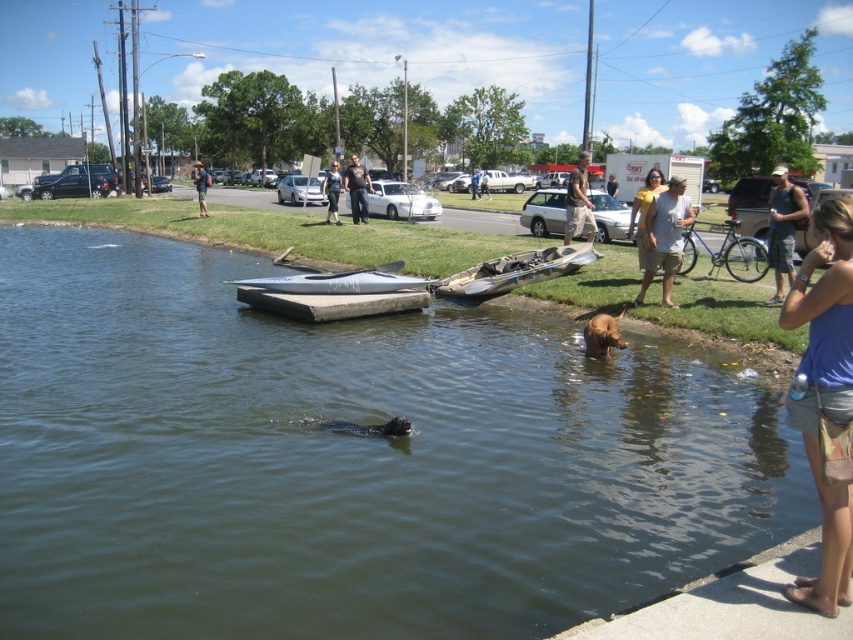
Is point (828, 490) closer to viewer compared to point (595, 332)?

That is True.

Measure the distance between blue fabric tank top at lower right and brown furry dog at lower right.

The distance of blue fabric tank top at lower right from brown furry dog at lower right is 19.47 feet.

Where is `blue fabric tank top at lower right`? Image resolution: width=853 pixels, height=640 pixels. blue fabric tank top at lower right is located at coordinates (824, 394).

Who is more distant from viewer, (535,280) or (782,243)?

The point (535,280) is behind.

This screenshot has width=853, height=640. What do you see at coordinates (515, 269) in the screenshot?
I see `white plastic kayak at center` at bounding box center [515, 269].

Is point (573, 264) farther from viewer compared to point (775, 202)?

Yes, point (573, 264) is behind point (775, 202).

Identify the location of white plastic kayak at center. The height and width of the screenshot is (640, 853). (515, 269).

Which is below, blue fabric tank top at lower right or light brown shorts at center?

Positioned lower is blue fabric tank top at lower right.

Does blue fabric tank top at lower right have a larger size compared to light brown shorts at center?

Incorrect, blue fabric tank top at lower right is not larger than light brown shorts at center.

Does point (842, 556) come farther from viewer compared to point (482, 182)?

No, it is not.

Locate an element on the screen. Image resolution: width=853 pixels, height=640 pixels. blue fabric tank top at lower right is located at coordinates (824, 394).